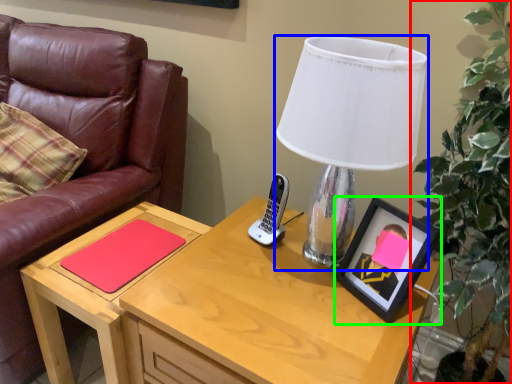
Question: Which object is the farthest from houseplant (highlighted by a red box)? Choose among these: lamp (highlighted by a blue box) or picture frame (highlighted by a green box).

Choices:
 (A) lamp
 (B) picture frame

Answer: (A)